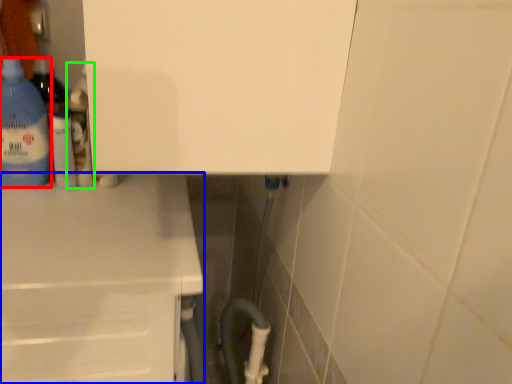
Question: Which is nearer to the bottle (highlighted by a red box)? counter (highlighted by a blue box) or bottle (highlighted by a green box).

Choices:
 (A) counter
 (B) bottle

Answer: (B)